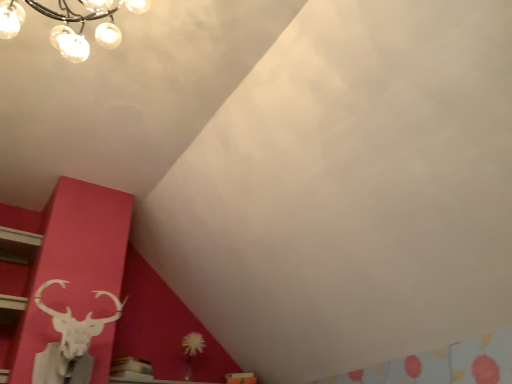
This screenshot has height=384, width=512. Find the location of `matte glass chandelier at upper left`. matte glass chandelier at upper left is located at coordinates (83, 28).

Image resolution: width=512 pixels, height=384 pixels. What do you see at coordinates (83, 28) in the screenshot?
I see `matte glass chandelier at upper left` at bounding box center [83, 28].

The image size is (512, 384). Find the location of `matte glass chandelier at upper left`. matte glass chandelier at upper left is located at coordinates (83, 28).